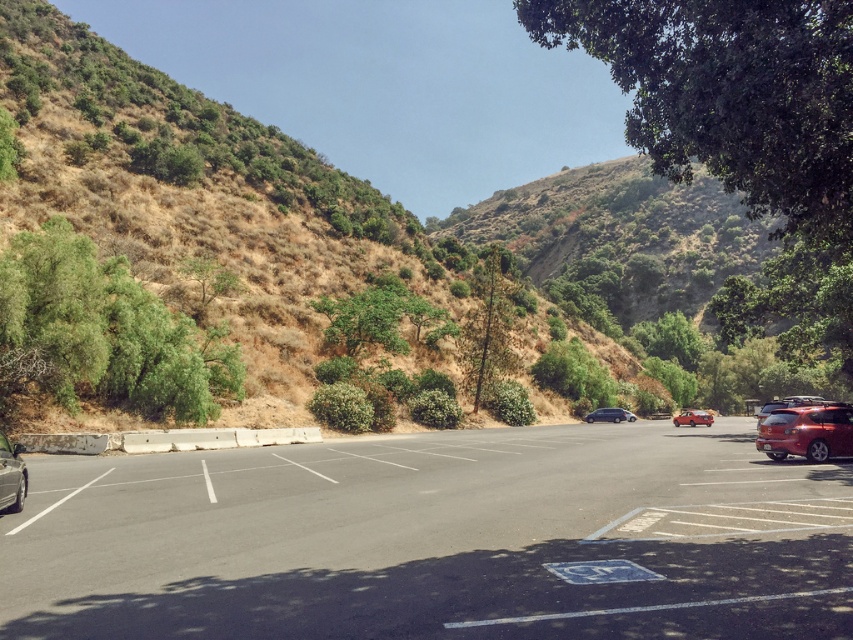
Question: Does green leafy tree at upper right appear under metallic silver car at left?

Choices:
 (A) yes
 (B) no

Answer: (B)

Question: Which of the following is the farthest from the observer?

Choices:
 (A) shiny metallic car at lower right
 (B) metallic silver car at left
 (C) shiny red car at center

Answer: (C)

Question: Which object is farther from the camera taking this photo?

Choices:
 (A) dried grass at center
 (B) green textured tree at center
 (C) shiny red car at center
 (D) satin black sedan at center

Answer: (D)

Question: Can you confirm if dried grass at center is positioned to the left of green textured tree at center?

Choices:
 (A) yes
 (B) no

Answer: (A)

Question: Which point is farther to the camera?

Choices:
 (A) dried grass at center
 (B) black asphalt parking lot at center

Answer: (A)

Question: Can you confirm if black asphalt parking lot at center is smaller than metallic silver car at left?

Choices:
 (A) yes
 (B) no

Answer: (B)